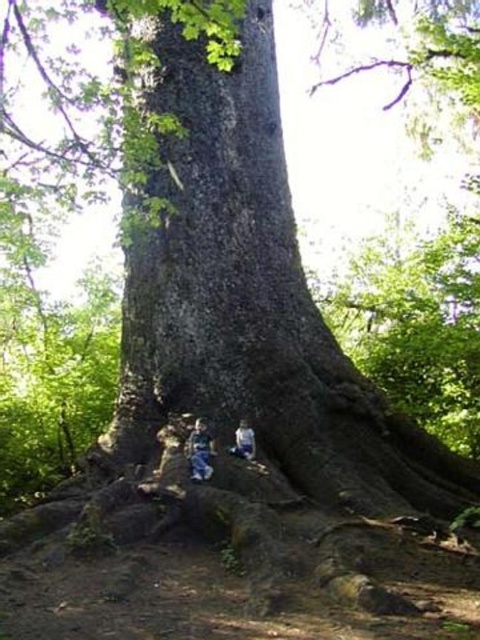
Based on the scene description, where exactly is the green rough bark at center located?

The green rough bark at center is located at point (x=253, y=300).

You are a photographer trying to capture the entire tree and the two people sitting at its base. Given the green rough bark at center and the blue denim jeans at lower center, which object in the scene would require a wider angle lens to include in the photograph?

The green rough bark at center is larger in size than the blue denim jeans at lower center, so it would require a wider angle lens to capture its full size in the photograph.

Looking at this image, you are a photographer trying to capture the scale of the massive tree. You notice the green rough bark at center and the light blue denim jeans at lower center in your frame. Which object should you focus on to emphasize the tree s enormous size?

To emphasize the tree s enormous size, focus on the green rough bark at center since it is larger than the light blue denim jeans at lower center, creating a clear contrast in scale.